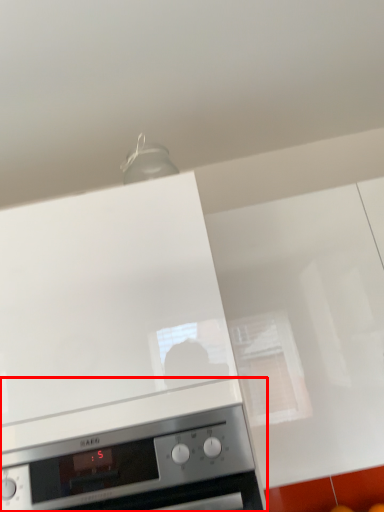
Question: In this image, where is home appliance (annotated by the red box) located relative to home appliance?

Choices:
 (A) left
 (B) right

Answer: (B)